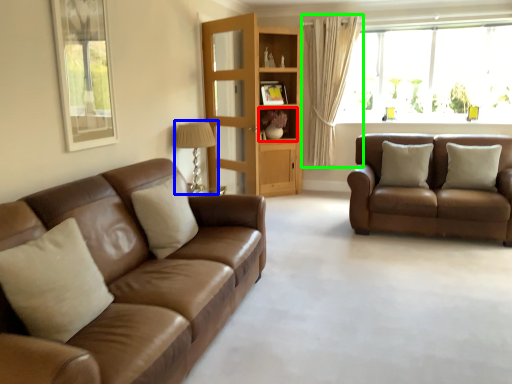
Question: Which object is positioned farthest from shelf (highlighted by a red box)? Select from lamp (highlighted by a blue box) and curtain (highlighted by a green box).

Choices:
 (A) lamp
 (B) curtain

Answer: (A)